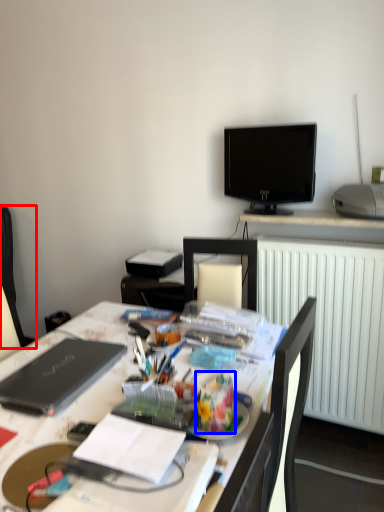
Question: Which of the following is the closest to the observer, computer chair (highlighted by a red box) or stationery (highlighted by a blue box)?

Choices:
 (A) computer chair
 (B) stationery

Answer: (B)